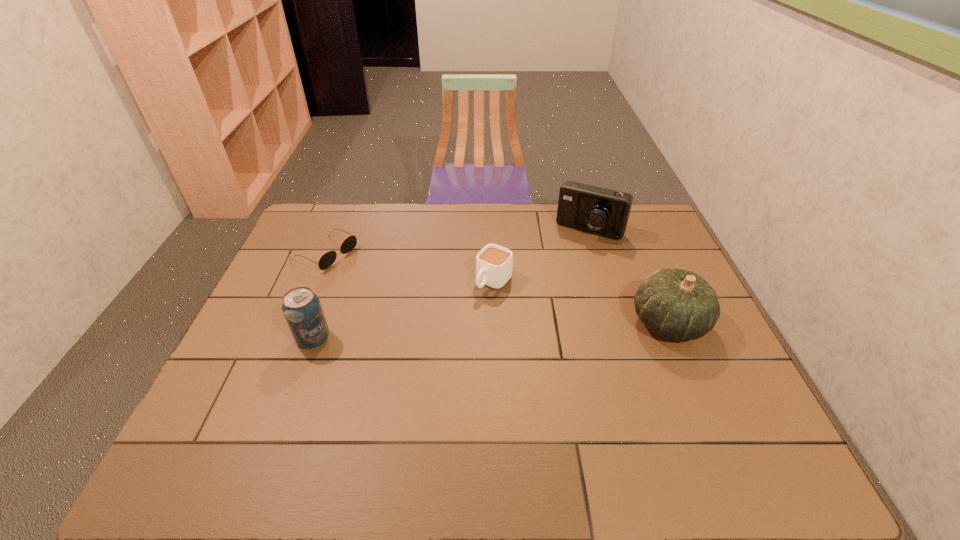
Where is `free spot on the desktop that is between the pop soda and the gourd and is positioned on the front-facing side of the sunglasses`? The height and width of the screenshot is (540, 960). free spot on the desktop that is between the pop soda and the gourd and is positioned on the front-facing side of the sunglasses is located at coordinates (492, 330).

In order to click on free spot on the desktop that is between the pop soda and the gourd and is positioned on the front-facing side of the camera in this screenshot , I will do `click(529, 328)`.

Where is `vacant spot on the desktop that is between the pop soda and the gourd and is positioned on the side with the handle of the fourth tallest object`? Image resolution: width=960 pixels, height=540 pixels. vacant spot on the desktop that is between the pop soda and the gourd and is positioned on the side with the handle of the fourth tallest object is located at coordinates (447, 332).